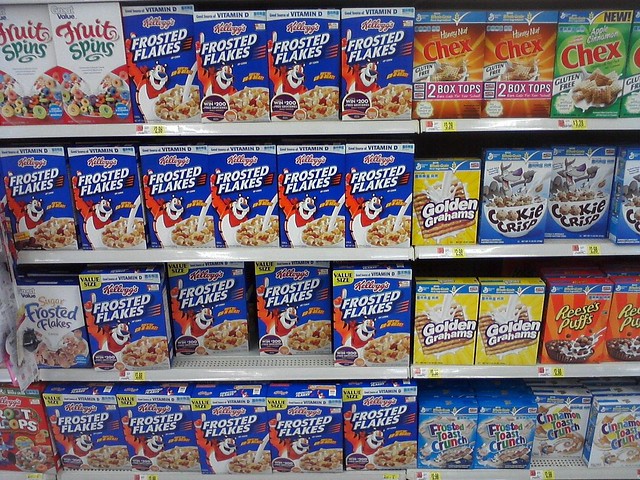
The height and width of the screenshot is (480, 640). Find the location of `cereal boxes on the top shelf`. cereal boxes on the top shelf is located at coordinates (29, 68), (88, 66), (160, 63), (218, 65), (301, 63), (385, 60), (457, 68), (525, 63), (596, 59), (630, 64).